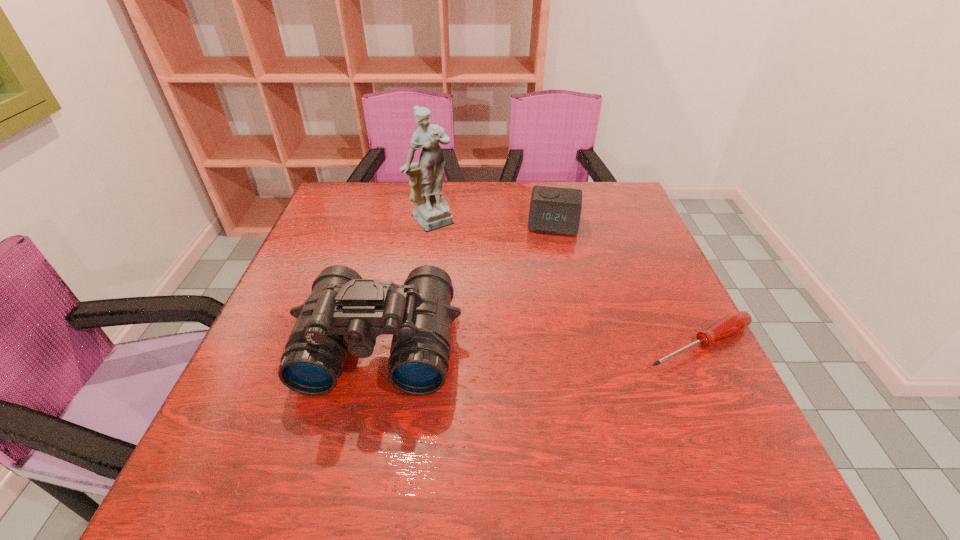
Find the location of a particular element. This screenshot has width=960, height=540. vacant space located on the front-facing side of the tallest object is located at coordinates (460, 241).

Find the location of a particular element. Image resolution: width=960 pixels, height=540 pixels. free space located on the front-facing side of the tallest object is located at coordinates (543, 315).

Locate an element on the screen. This screenshot has height=540, width=960. vacant space located on the front-facing side of the tallest object is located at coordinates (534, 307).

Identify the location of alarm clock that is positioned at the far edge. (554, 210).

You are a GUI agent. You are given a task and a screenshot of the screen. Output one action in this format:
    pyautogui.click(x=<x>, y=<y>)
    Task: Click on the figurine positioned at the far edge
    This screenshot has width=960, height=540.
    Given the screenshot: What is the action you would take?
    pyautogui.click(x=431, y=210)

The height and width of the screenshot is (540, 960). Find the location of `object present at the near edge`. object present at the near edge is located at coordinates (344, 314).

Locate an element on the screen. The width and height of the screenshot is (960, 540). object that is at the left edge is located at coordinates (344, 314).

Where is `object that is at the right edge`? The image size is (960, 540). object that is at the right edge is located at coordinates (734, 323).

You are a GUI agent. You are given a task and a screenshot of the screen. Output one action in this format:
    pyautogui.click(x=<x>, y=<y>)
    Task: Click on the object that is at the near left corner
    The image size is (960, 540).
    Given the screenshot: What is the action you would take?
    pyautogui.click(x=344, y=314)

In the image, there is a desktop. What are the coordinates of `blank space at the far edge` in the screenshot? It's located at (471, 190).